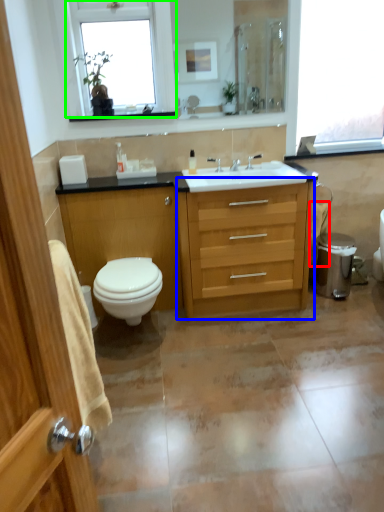
Question: Which object is positioned closest to toilet paper (highlighted by a red box)? Select from chest of drawers (highlighted by a blue box) and window (highlighted by a green box).

Choices:
 (A) chest of drawers
 (B) window

Answer: (A)